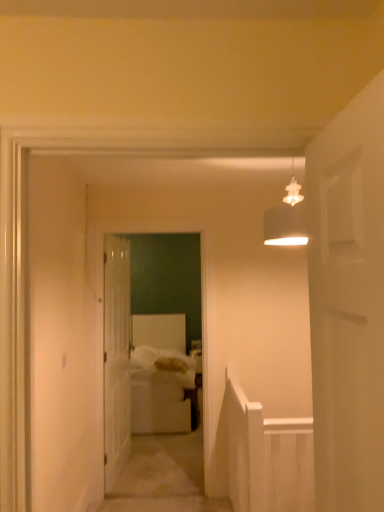
Locate an element on the screen. The width and height of the screenshot is (384, 512). free spot below white fabric bed at center (from a real-world perspective) is located at coordinates (167, 496).